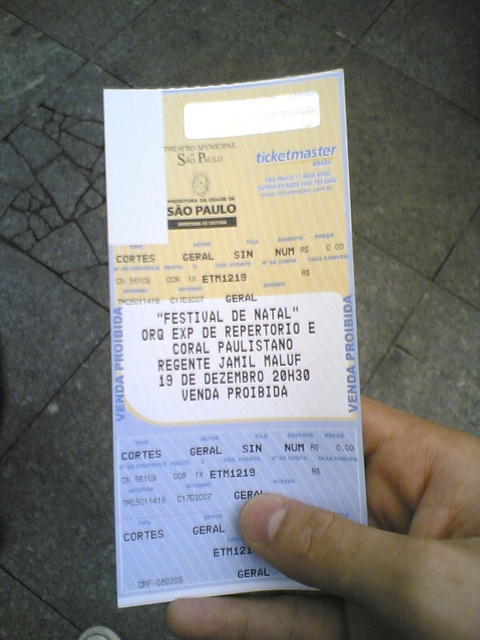
Between white paper ticket at center and skinny white hand at lower right, which one has less height?

Standing shorter between the two is skinny white hand at lower right.

Does white paper ticket at center come in front of skinny white hand at lower right?

No, it is behind skinny white hand at lower right.

Does point (311, 248) come behind point (265, 552)?

Yes, it is.

This screenshot has width=480, height=640. I want to click on white paper ticket at center, so click(x=228, y=324).